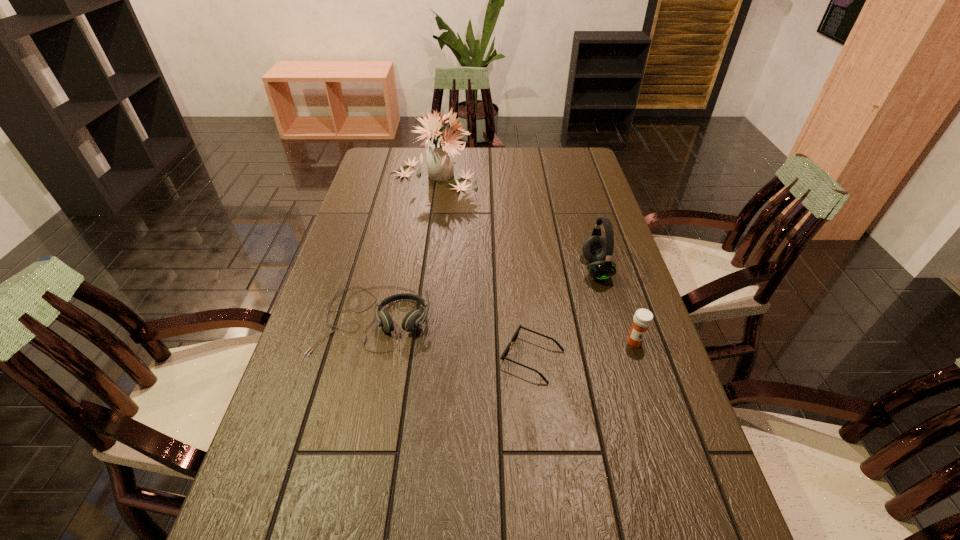
This screenshot has width=960, height=540. Identify the location of free space between the sunglasses and the medicine. (584, 350).

Image resolution: width=960 pixels, height=540 pixels. In order to click on blank region between the farthest object and the third shortest object in this screenshot , I will do `click(534, 260)`.

Where is `free space between the shorter headset and the sunglasses`? This screenshot has height=540, width=960. free space between the shorter headset and the sunglasses is located at coordinates (453, 339).

This screenshot has height=540, width=960. Find the location of `free space that is in between the shorter headset and the taller headset`. free space that is in between the shorter headset and the taller headset is located at coordinates (485, 294).

Where is `free spot between the third object from right to left and the taller headset`? free spot between the third object from right to left and the taller headset is located at coordinates (564, 314).

Find the location of `vacant region between the bouquet and the second tallest object`. vacant region between the bouquet and the second tallest object is located at coordinates [515, 223].

Choose which object is the nearest neighbor to the second shortest object. Please provide its 2D coordinates. Your answer should be formatted as a tuple, i.e. [(x, y)], where the tuple contains the x and y coordinates of a point satisfying the conditions above.

[(515, 336)]

Identify the location of object that is the closest one to the third tallest object. Image resolution: width=960 pixels, height=540 pixels. (515, 336).

Image resolution: width=960 pixels, height=540 pixels. I want to click on vacant space that satisfies the following two spatial constraints: 1. on the ear cups of the fourth shortest object; 2. on the outer surface of the left headset, so click(x=611, y=319).

Identify the location of free space that satisfies the following two spatial constraints: 1. on the ear cups of the taller headset; 2. on the outer surface of the left headset. The width and height of the screenshot is (960, 540). (611, 319).